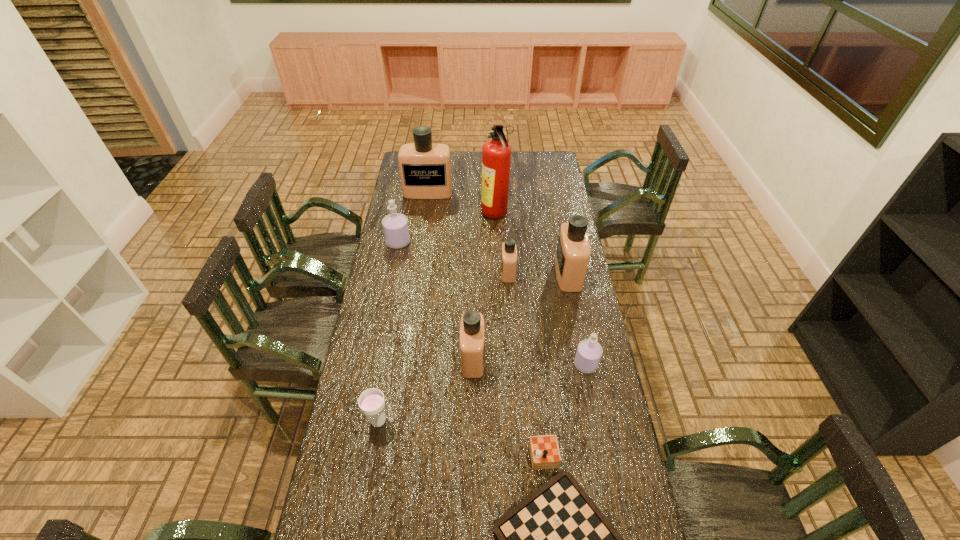
The image size is (960, 540). Find the location of `vacant point located 0.360m on the front label of the third tallest object`. vacant point located 0.360m on the front label of the third tallest object is located at coordinates (474, 274).

Where is `vacant area situated 0.360m on the front label of the third tallest object`? vacant area situated 0.360m on the front label of the third tallest object is located at coordinates (474, 274).

At what (x,y) coordinates should I click in order to perform the action: click on vacant point located 0.240m on the front label of the third tallest object. Please return your answer as a coordinate pair (x, y). Looking at the image, I should click on 501,274.

The image size is (960, 540). Identify the location of blank space located 0.270m on the back of the third farthest object. (406, 201).

The image size is (960, 540). I want to click on blank area located 0.050m on the front label of the third beige perfume from right to left, so click(498, 358).

The image size is (960, 540). In order to click on vacant region located on the front of the nearer purple perfume in this screenshot , I will do (598, 428).

I want to click on free region located on the front label of the third beige perfume from left to right, so click(x=467, y=272).

Locate an element on the screen. This screenshot has height=540, width=960. vacant region located on the front label of the third beige perfume from left to right is located at coordinates (421, 272).

In order to click on vacant space located on the front label of the third beige perfume from left to right in this screenshot , I will do `click(458, 272)`.

Identify the location of free spot located on the back of the second shortest object. The width and height of the screenshot is (960, 540). (392, 340).